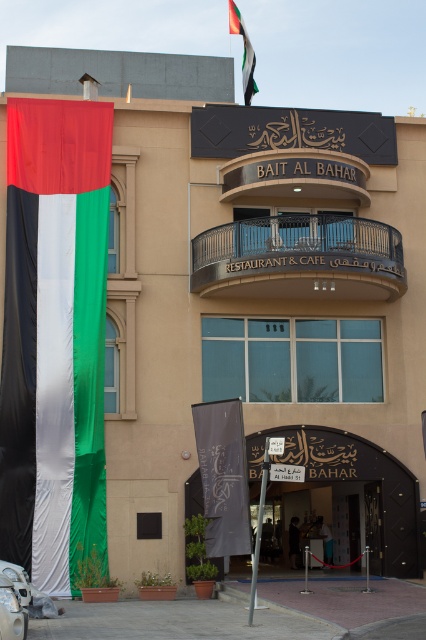
Question: Based on their relative distances, which object is nearer to the metallic pole at center?

Choices:
 (A) metallic wrought iron balcony at center
 (B) embossed fabric flag at upper center
 (C) silky fabric flag at left

Answer: (A)

Question: From the image, what is the correct spatial relationship of metallic wrought iron balcony at center in relation to embossed fabric flag at upper center?

Choices:
 (A) right
 (B) left

Answer: (A)

Question: Observing the image, what is the correct spatial positioning of silky fabric flag at left in reference to embossed fabric flag at upper center?

Choices:
 (A) above
 (B) below

Answer: (B)

Question: Is silky fabric flag at left in front of embossed fabric flag at upper center?

Choices:
 (A) no
 (B) yes

Answer: (B)

Question: Which point is closer to the camera?

Choices:
 (A) (206, 241)
 (B) (241, 22)
 (C) (250, 604)

Answer: (C)

Question: Among these objects, which one is farthest from the camera?

Choices:
 (A) silky fabric flag at left
 (B) metallic wrought iron balcony at center
 (C) metallic pole at center
 (D) embossed fabric flag at upper center

Answer: (D)